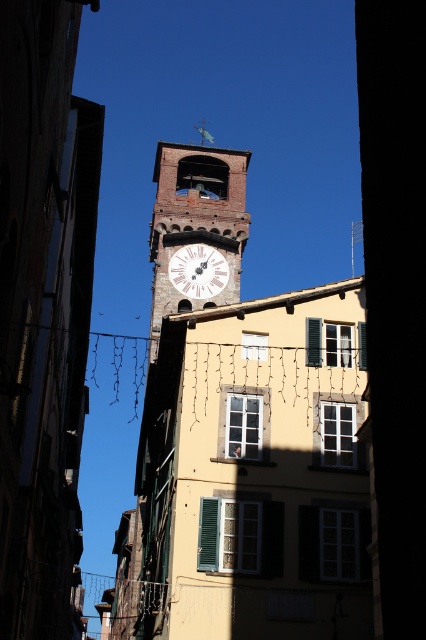
Question: Which object appears farthest from the camera in this image?

Choices:
 (A) white painted stone clock tower at center
 (B) white wooden clock at center

Answer: (B)

Question: Can you confirm if white painted stone clock tower at center is bigger than white wooden clock at center?

Choices:
 (A) yes
 (B) no

Answer: (A)

Question: Does white painted stone clock tower at center appear over white wooden clock at center?

Choices:
 (A) no
 (B) yes

Answer: (B)

Question: Which object is closer to the camera taking this photo?

Choices:
 (A) white painted stone clock tower at center
 (B) white wooden clock at center

Answer: (A)

Question: Is the position of white painted stone clock tower at center more distant than that of white wooden clock at center?

Choices:
 (A) no
 (B) yes

Answer: (A)